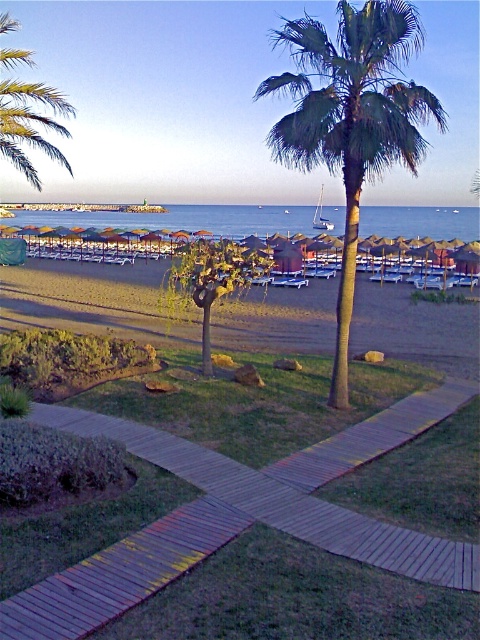
You are a visitor at the beach and want to place your beach towel. You see the wooden at center and the blue water at center. Which object is located to the left of the other?

The wooden at center is positioned on the left side of blue water at center.

You are planning to place a new bench in the beach scene. The bench requires a space larger than the wooden at center. Can the blue water at center accommodate it?

The wooden at center is smaller than blue water at center, so yes, the blue water at center can accommodate the bench since it is larger than the wooden at center.